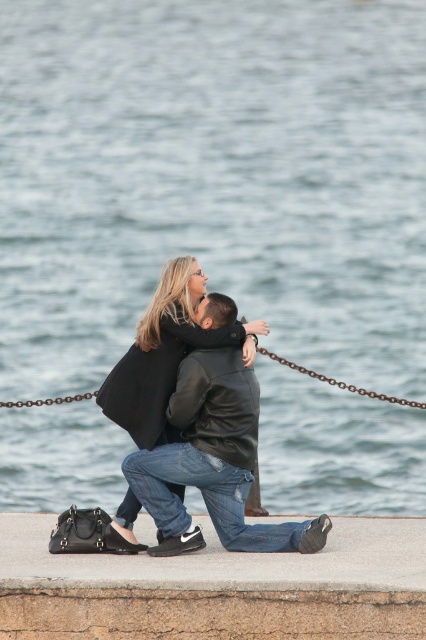
Does concrete at lower center appear on the left side of black leather jacket at center?

Yes, concrete at lower center is to the left of black leather jacket at center.

Describe the element at coordinates (216, 588) in the screenshot. I see `concrete at lower center` at that location.

Locate an element on the screen. concrete at lower center is located at coordinates (216, 588).